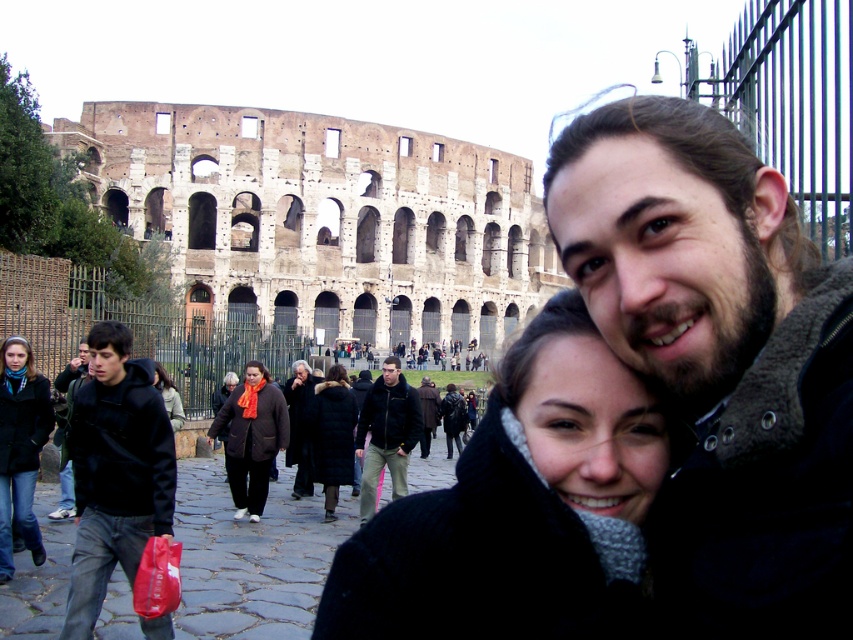
You are a tourist standing in front of the Colosseum and want to take a photo of the dark brown leather jacket at center without the black matte jacket at left blocking it. How should you adjust your position?

The black matte jacket at left is in front of the dark brown leather jacket at center. To avoid the black matte jacket at left blocking the view, move to the right side so that the dark brown leather jacket at center becomes visible behind the black matte jacket at left.